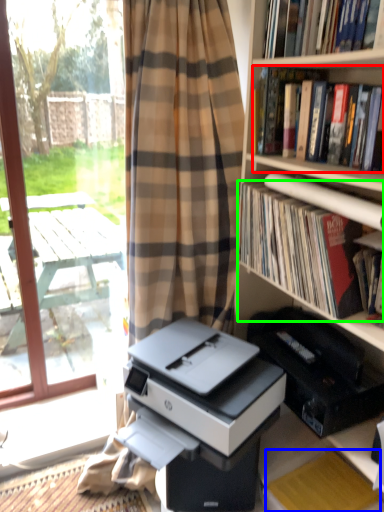
Question: Which object is positioned closest to book (highlighted by a red box)? Select from paperback book (highlighted by a blue box) and book (highlighted by a green box).

Choices:
 (A) paperback book
 (B) book

Answer: (B)